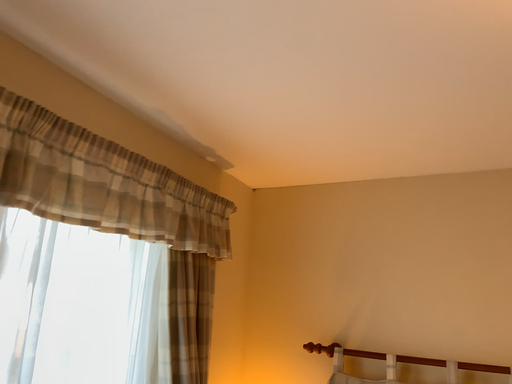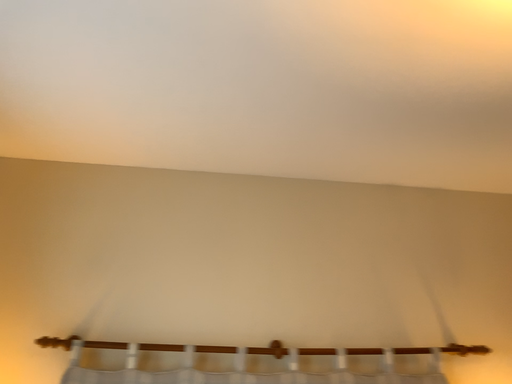
Question: How did the camera likely rotate when shooting the video?

Choices:
 (A) rotated left
 (B) rotated right

Answer: (B)